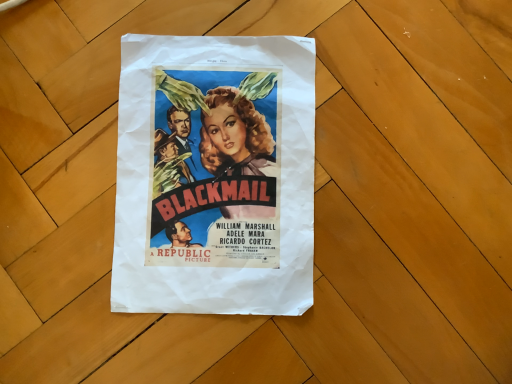
The width and height of the screenshot is (512, 384). I want to click on free spot above matte paper poster at center (from a real-world perspective), so click(x=217, y=168).